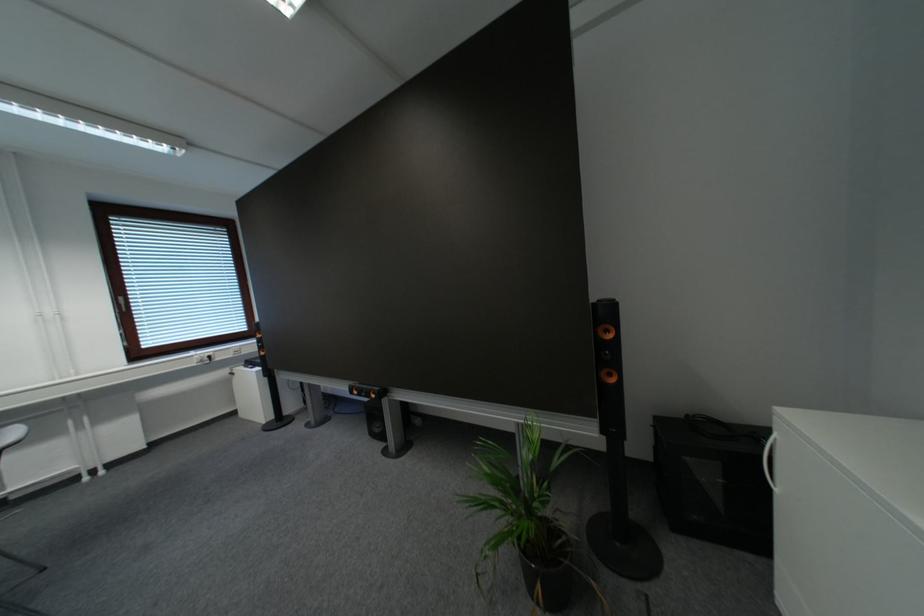
The width and height of the screenshot is (924, 616). What do you see at coordinates (202, 358) in the screenshot?
I see `the white power outlet` at bounding box center [202, 358].